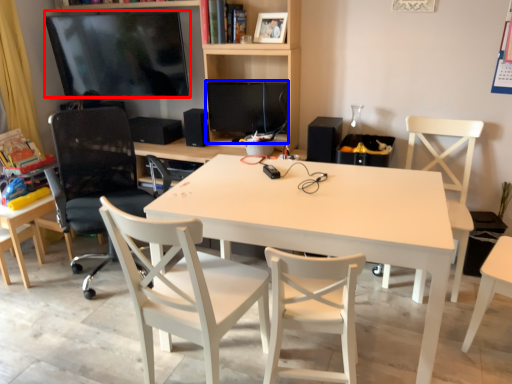
Question: Which point is further to the camera, television (highlighted by a red box) or computer monitor (highlighted by a blue box)?

Choices:
 (A) television
 (B) computer monitor

Answer: (A)